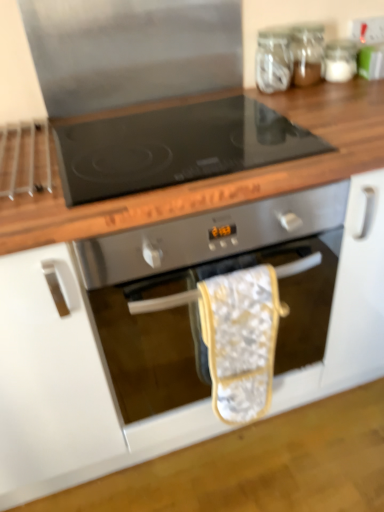
Image resolution: width=384 pixels, height=512 pixels. I want to click on transparent glass jar at upper right, positioned as the 3th glass jar in right-to-left order, so click(273, 60).

What do you see at coordinates (340, 60) in the screenshot?
I see `transparent glass jar at upper right, the third glass jar in the left-to-right sequence` at bounding box center [340, 60].

Where is `transparent glass jar at upper right, positioned as the 3th glass jar in right-to-left order`? The width and height of the screenshot is (384, 512). transparent glass jar at upper right, positioned as the 3th glass jar in right-to-left order is located at coordinates (273, 60).

Could you tell me if stainless steel oven at center is facing transparent glass jar at upper right, marked as the 1th glass jar in a right-to-left arrangement?

No, stainless steel oven at center is not aimed at transparent glass jar at upper right, marked as the 1th glass jar in a right-to-left arrangement.

Can you confirm if stainless steel oven at center is bigger than transparent glass jar at upper right, the third glass jar in the left-to-right sequence?

Indeed, stainless steel oven at center has a larger size compared to transparent glass jar at upper right, the third glass jar in the left-to-right sequence.

Between stainless steel oven at center and transparent glass jar at upper right, the third glass jar in the left-to-right sequence, which one appears on the right side from the viewer's perspective?

From the viewer's perspective, transparent glass jar at upper right, the third glass jar in the left-to-right sequence, appears more on the right side.

I want to click on glass jar that is the 2nd object directly below the transparent glass jar at upper right, placed as the 2th glass jar when sorted from left to right (from a real-world perspective), so click(x=340, y=60).

Which of these two, transparent glass jar at upper right, which appears as the second glass jar when viewed from the right, or transparent glass jar at upper right, the third glass jar in the left-to-right sequence, stands shorter?

Standing shorter between the two is transparent glass jar at upper right, the third glass jar in the left-to-right sequence.

Choose the correct answer: Is transparent glass jar at upper right, placed as the 2th glass jar when sorted from left to right, inside transparent glass jar at upper right, the third glass jar in the left-to-right sequence, or outside it?

transparent glass jar at upper right, placed as the 2th glass jar when sorted from left to right, cannot be found inside transparent glass jar at upper right, the third glass jar in the left-to-right sequence.

Considering the relative sizes of transparent glass jar at upper right, placed as the 2th glass jar when sorted from left to right, and transparent glass jar at upper right, the third glass jar in the left-to-right sequence, in the image provided, is transparent glass jar at upper right, placed as the 2th glass jar when sorted from left to right, wider than transparent glass jar at upper right, the third glass jar in the left-to-right sequence,?

Yes.

Is point (304, 62) closer to viewer compared to point (19, 223)?

No.

Is transparent glass jar at upper right, placed as the 2th glass jar when sorted from left to right, shorter than wooden at upper center?

Indeed, transparent glass jar at upper right, placed as the 2th glass jar when sorted from left to right, has a lesser height compared to wooden at upper center.

Identify the location of countertop on the left of transparent glass jar at upper right, placed as the 2th glass jar when sorted from left to right. (218, 177).

Which object is more forward, transparent glass jar at upper right, which appears as the second glass jar when viewed from the right, or wooden at upper center?

Positioned in front is wooden at upper center.

In the scene shown: Is transparent glass jar at upper right, which appears as the second glass jar when viewed from the right, far away from stainless steel oven at center?

No, transparent glass jar at upper right, which appears as the second glass jar when viewed from the right, is not far from stainless steel oven at center.

In order to click on glass jar that is the 3rd one above the stainless steel oven at center (from a real-world perspective) in this screenshot , I will do `click(307, 52)`.

Which is behind, point (294, 53) or point (148, 282)?

Point (294, 53)

Based on the photo, from a real-world perspective, is transparent glass jar at upper right, which appears as the second glass jar when viewed from the right, on top of stainless steel oven at center?

Yes.

Which of these two, transparent glass jar at upper right, positioned as the 3th glass jar in right-to-left order, or white fabric oven mitt at center, is smaller?

transparent glass jar at upper right, positioned as the 3th glass jar in right-to-left order, is smaller.

Could you tell me if transparent glass jar at upper right, the first glass jar from the left, is facing white fabric oven mitt at center?

No, transparent glass jar at upper right, the first glass jar from the left, is not oriented towards white fabric oven mitt at center.

Looking at this image, from the image's perspective, does transparent glass jar at upper right, positioned as the 3th glass jar in right-to-left order, appear lower than white fabric oven mitt at center?

No, from the image's perspective, transparent glass jar at upper right, positioned as the 3th glass jar in right-to-left order, is not below white fabric oven mitt at center.

Considering the relative sizes of stainless steel oven at center and transparent glass jar at upper right, positioned as the 3th glass jar in right-to-left order, in the image provided, is stainless steel oven at center wider than transparent glass jar at upper right, positioned as the 3th glass jar in right-to-left order,?

Yes, stainless steel oven at center is wider than transparent glass jar at upper right, positioned as the 3th glass jar in right-to-left order.

Is stainless steel oven at center not close to transparent glass jar at upper right, positioned as the 3th glass jar in right-to-left order?

No, stainless steel oven at center is not far from transparent glass jar at upper right, positioned as the 3th glass jar in right-to-left order.

Identify the location of oven in front of the transparent glass jar at upper right, the first glass jar from the left. (195, 287).

Considering their positions, is white fabric oven mitt at center located in front of or behind stainless steel oven at center?

Clearly, white fabric oven mitt at center is behind stainless steel oven at center.

Are white fabric oven mitt at center and stainless steel oven at center located far from each other?

That's not correct — white fabric oven mitt at center is a little close to stainless steel oven at center.

From the image's perspective, which is below, white fabric oven mitt at center or stainless steel oven at center?

white fabric oven mitt at center is shown below in the image.

Considering the relative sizes of white fabric oven mitt at center and stainless steel oven at center in the image provided, is white fabric oven mitt at center smaller than stainless steel oven at center?

Yes.

Where is `the 1st glass jar above the stainless steel oven at center (from a real-world perspective)`? the 1st glass jar above the stainless steel oven at center (from a real-world perspective) is located at coordinates (340, 60).

The width and height of the screenshot is (384, 512). What are the coordinates of `the 1st glass jar in front of the transparent glass jar at upper right, the third glass jar in the left-to-right sequence, starting your count from the anchor` in the screenshot? It's located at (307, 52).

Based on their spatial positions, is transparent glass jar at upper right, marked as the 1th glass jar in a right-to-left arrangement, or white fabric oven mitt at center further from stainless steel oven at center?

transparent glass jar at upper right, marked as the 1th glass jar in a right-to-left arrangement, lies further to stainless steel oven at center than the other object.

When comparing their distances from transparent glass jar at upper right, marked as the 1th glass jar in a right-to-left arrangement, does white fabric oven mitt at center or transparent glass jar at upper right, the first glass jar from the left, seem further?

Based on the image, white fabric oven mitt at center appears to be further to transparent glass jar at upper right, marked as the 1th glass jar in a right-to-left arrangement.

Based on their spatial positions, is wooden at upper center or transparent glass jar at upper right, the third glass jar in the left-to-right sequence, closer to white fabric oven mitt at center?

wooden at upper center.

Estimate the real-world distances between objects in this image. Which object is closer to transparent glass jar at upper right, marked as the 1th glass jar in a right-to-left arrangement, stainless steel oven at center or transparent glass jar at upper right, the first glass jar from the left?

Among the two, transparent glass jar at upper right, the first glass jar from the left, is located nearer to transparent glass jar at upper right, marked as the 1th glass jar in a right-to-left arrangement.

Considering their positions, is transparent glass jar at upper right, the first glass jar from the left, positioned further to wooden at upper center than transparent glass jar at upper right, marked as the 1th glass jar in a right-to-left arrangement?

transparent glass jar at upper right, marked as the 1th glass jar in a right-to-left arrangement, is further to wooden at upper center.

Considering their positions, is transparent glass jar at upper right, the third glass jar in the left-to-right sequence, positioned closer to transparent glass jar at upper right, which appears as the second glass jar when viewed from the right, than stainless steel oven at center?

Among the two, transparent glass jar at upper right, the third glass jar in the left-to-right sequence, is located nearer to transparent glass jar at upper right, which appears as the second glass jar when viewed from the right.

Estimate the real-world distances between objects in this image. Which object is further from white fabric oven mitt at center, wooden at upper center or transparent glass jar at upper right, which appears as the second glass jar when viewed from the right?

transparent glass jar at upper right, which appears as the second glass jar when viewed from the right, lies further to white fabric oven mitt at center than the other object.

Based on their spatial positions, is white fabric oven mitt at center or transparent glass jar at upper right, marked as the 1th glass jar in a right-to-left arrangement, further from transparent glass jar at upper right, positioned as the 3th glass jar in right-to-left order?

Based on the image, white fabric oven mitt at center appears to be further to transparent glass jar at upper right, positioned as the 3th glass jar in right-to-left order.

Where is `countertop between transparent glass jar at upper right, marked as the 1th glass jar in a right-to-left arrangement, and white fabric oven mitt at center from top to bottom`? The height and width of the screenshot is (512, 384). countertop between transparent glass jar at upper right, marked as the 1th glass jar in a right-to-left arrangement, and white fabric oven mitt at center from top to bottom is located at coordinates (218, 177).

The image size is (384, 512). What are the coordinates of `glass jar between transparent glass jar at upper right, the third glass jar in the left-to-right sequence, and white fabric oven mitt at center, in the vertical direction` in the screenshot? It's located at (273, 60).

Where is `oven between transparent glass jar at upper right, positioned as the 3th glass jar in right-to-left order, and white fabric oven mitt at center, in the vertical direction`? The height and width of the screenshot is (512, 384). oven between transparent glass jar at upper right, positioned as the 3th glass jar in right-to-left order, and white fabric oven mitt at center, in the vertical direction is located at coordinates (195, 287).

The height and width of the screenshot is (512, 384). Find the location of `glass jar between transparent glass jar at upper right, the third glass jar in the left-to-right sequence, and stainless steel oven at center in the up-down direction`. glass jar between transparent glass jar at upper right, the third glass jar in the left-to-right sequence, and stainless steel oven at center in the up-down direction is located at coordinates (273, 60).